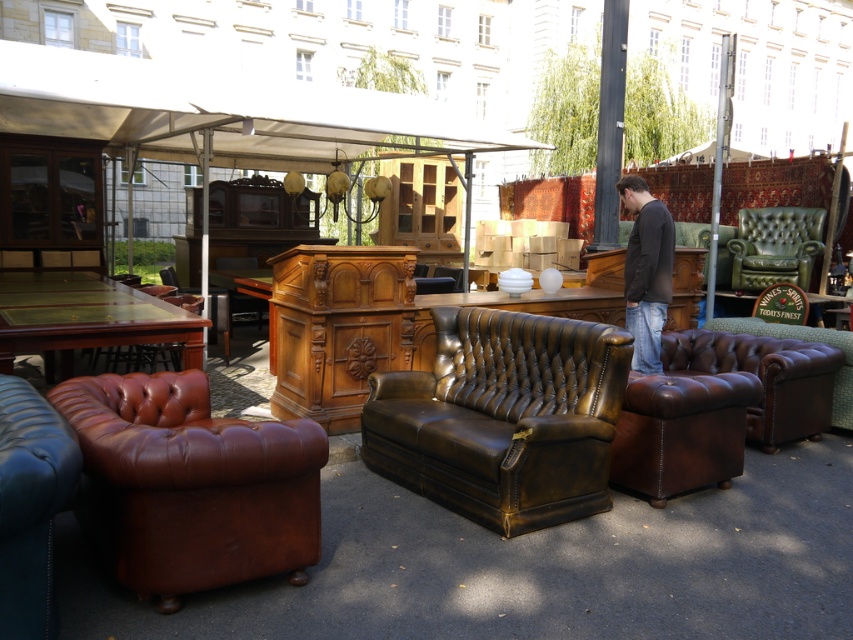
You are a customer at the outdoor market and want to place the matte blue leather couch at lower left and the green fabric couch at right in your living room. Your living room has a space of 5 meters between the two walls. Will the two couches fit side by side in this space?

The distance between the matte blue leather couch at lower left and green fabric couch at right is 5.84 meters. Since the available space in your living room is 5 meters, the couches will not fit side by side as they require more space than available.

You are a customer standing at the entrance of the flea market. You see the matte blue leather couch at lower left. Can you comfortably walk up to it without needing to step over any obstacles?

The distance between the matte blue leather couch at lower left and the viewer is 2.15 meters, so yes, you can comfortably walk up to it without needing to step over any obstacles as there is enough space.

Looking at this image, you are standing in the flea market and want to take a photo that includes both the vintage leather sofa and the antique armchair. The sofa is located at point [15,346] and the armchair is at point [846,342]. Which object is closer to you so you can adjust your camera angle accordingly?

The sofa at point [15,346] is closer to you than the armchair at point [846,342], so adjust your camera angle to ensure both are in frame.